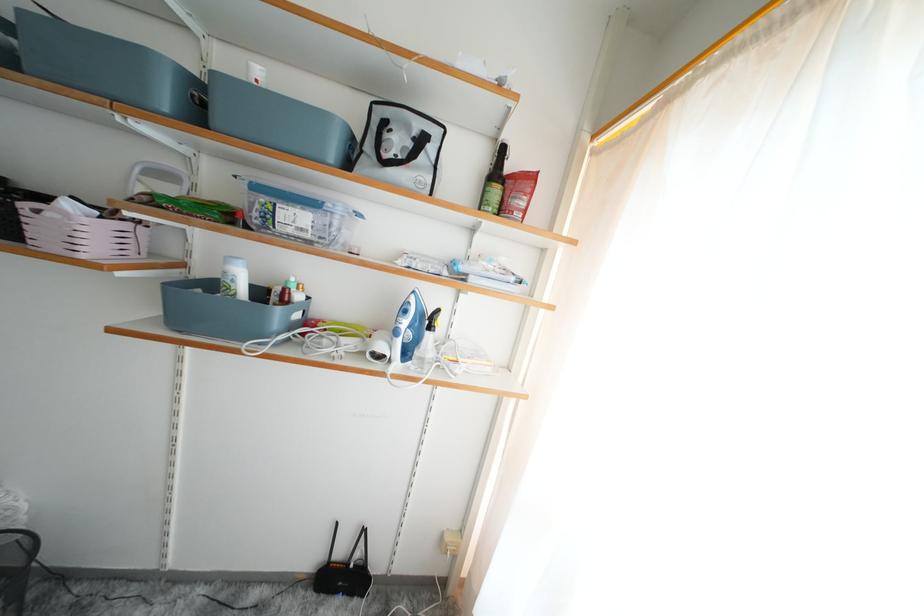
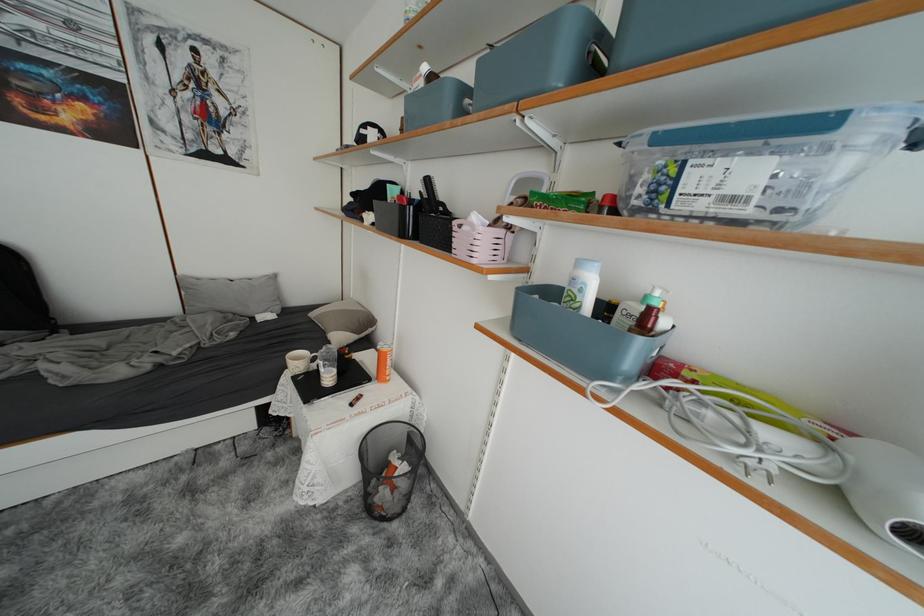
Find the pixel in the second image that matches point (200, 100) in the first image.

(596, 55)